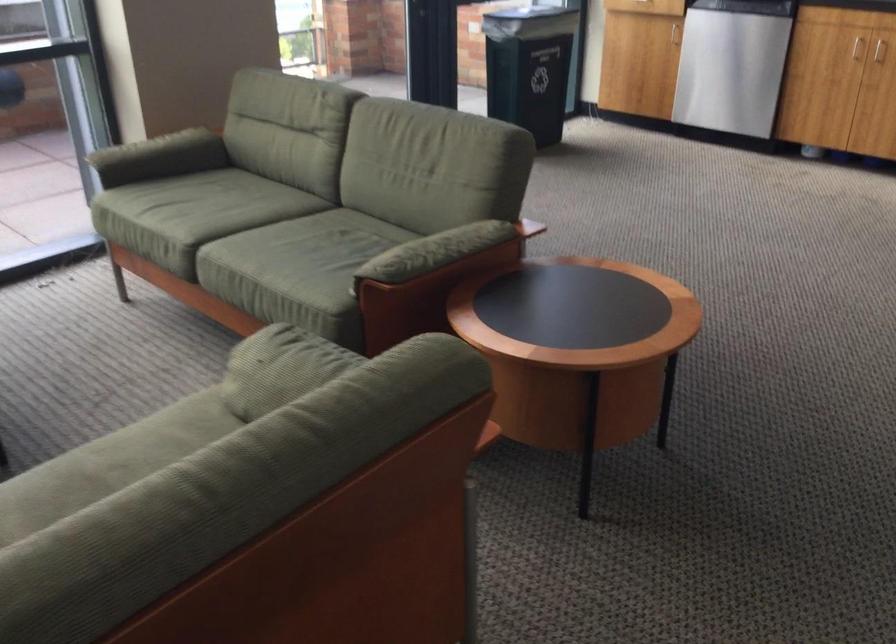
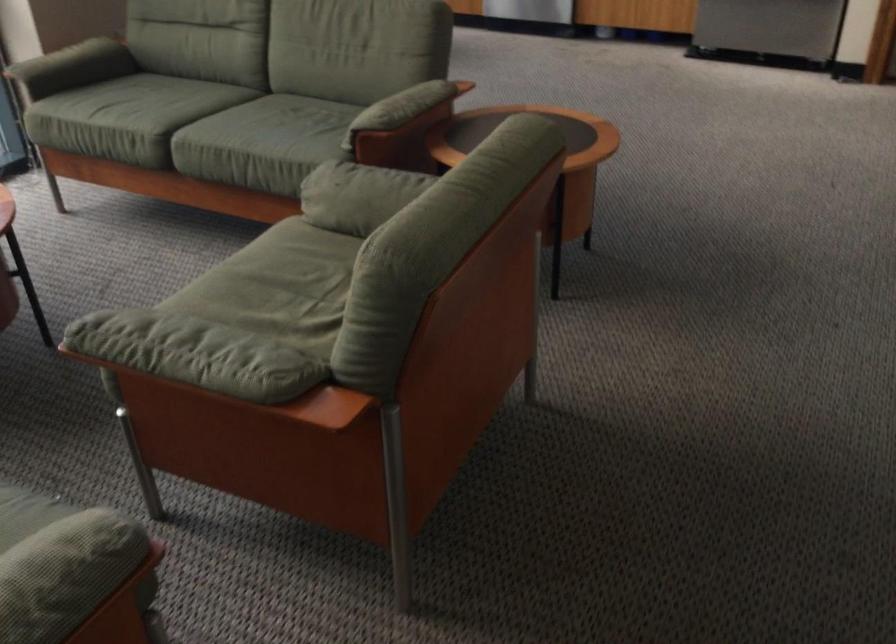
In the second image, find the point that corresponds to pixel 420 254 in the first image.

(398, 109)